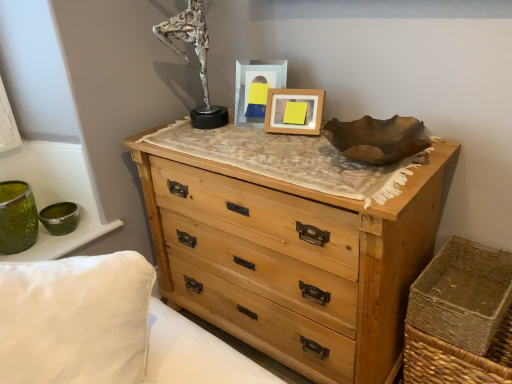
Question: Looking at their shapes, would you say silver metallic sculpture at upper center is wider or thinner than natural wood chest of drawers at center?

Choices:
 (A) thin
 (B) wide

Answer: (A)

Question: From a real-world perspective, relative to natural wood chest of drawers at center, is silver metallic sculpture at upper center vertically above or below?

Choices:
 (A) above
 (B) below

Answer: (A)

Question: Which of these objects is positioned farthest from the wooden picture frame at center, marked as the 1th picture frame in a right-to-left arrangement?

Choices:
 (A) natural wood chest of drawers at center
 (B) matte plastic picture frame at center, the 2th picture frame from the right
 (C) silver metallic sculpture at upper center
 (D) brown woven basket at lower right

Answer: (D)

Question: Which object is the farthest from the matte plastic picture frame at center, which is counted as the 1th picture frame, starting from the left?

Choices:
 (A) silver metallic sculpture at upper center
 (B) natural wood chest of drawers at center
 (C) wooden picture frame at center, marked as the 1th picture frame in a right-to-left arrangement
 (D) brown woven basket at lower right

Answer: (D)